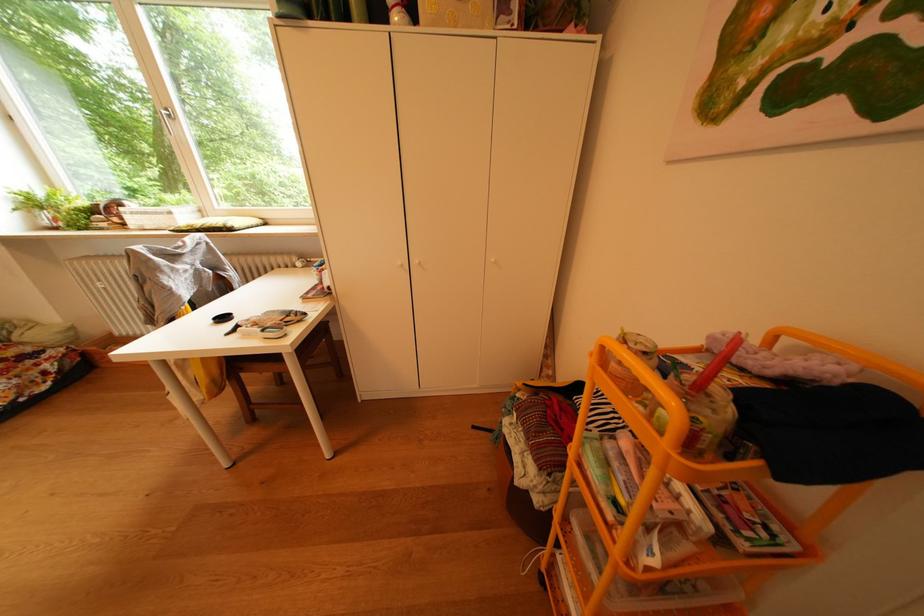
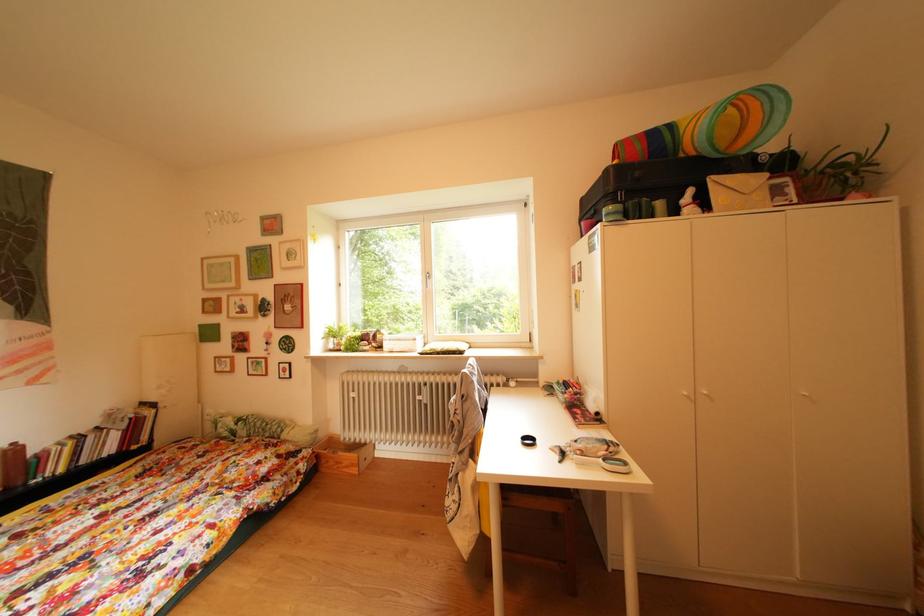
Question: In a continuous first-person perspective shot, in which direction is the camera moving?

Choices:
 (A) Left
 (B) Right
 (C) Forward
 (D) Backward

Answer: (A)